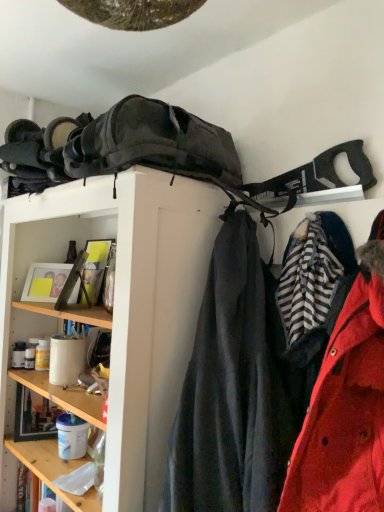
At what (x,y) coordinates should I click in order to perform the action: click on red matte coat at right. Please return your answer as a coordinate pair (x, y). This screenshot has height=512, width=384. Looking at the image, I should click on (346, 404).

The image size is (384, 512). What do you see at coordinates (346, 404) in the screenshot?
I see `red matte coat at right` at bounding box center [346, 404].

Measure the distance between matte black backpack at upper center and camera.

The depth of matte black backpack at upper center is 37.88 inches.

Where is `matte black backpack at upper center`? The image size is (384, 512). matte black backpack at upper center is located at coordinates (119, 307).

Describe the element at coordinates (119, 307) in the screenshot. I see `matte black backpack at upper center` at that location.

Where is `red matte coat at right`? The image size is (384, 512). red matte coat at right is located at coordinates (346, 404).

Which object is positioned more to the left, matte black backpack at upper center or red matte coat at right?

Positioned to the left is matte black backpack at upper center.

Is matte black backpack at upper center positioned behind red matte coat at right?

No, matte black backpack at upper center is closer to the viewer.

Considering the points (16, 272) and (370, 418), which point is behind, point (16, 272) or point (370, 418)?

The point (16, 272) is more distant.

From the image's perspective, which is above, matte black backpack at upper center or red matte coat at right?

red matte coat at right appears higher in the image.

From a real-world perspective, is matte black backpack at upper center on red matte coat at right?

No, from a real-world perspective, matte black backpack at upper center is not on top of red matte coat at right.

Which object is thinner, matte black backpack at upper center or red matte coat at right?

red matte coat at right is thinner.

Who is taller, matte black backpack at upper center or red matte coat at right?

With more height is matte black backpack at upper center.

Which of these two, matte black backpack at upper center or red matte coat at right, is bigger?

Bigger between the two is matte black backpack at upper center.

Is matte black backpack at upper center not within red matte coat at right?

Absolutely, matte black backpack at upper center is external to red matte coat at right.

Is matte black backpack at upper center not near red matte coat at right?

No, matte black backpack at upper center is in close proximity to red matte coat at right.

In the scene shown: Is red matte coat at right at the back of matte black backpack at upper center?

Yes, matte black backpack at upper center is positioned with its back facing red matte coat at right.

Where is `coat lying behind the matte black backpack at upper center`? The height and width of the screenshot is (512, 384). coat lying behind the matte black backpack at upper center is located at coordinates click(346, 404).

Between red matte coat at right and matte black backpack at upper center, which one appears on the left side from the viewer's perspective?

matte black backpack at upper center is more to the left.

Is red matte coat at right in front of or behind matte black backpack at upper center in the image?

Clearly, red matte coat at right is behind matte black backpack at upper center.

Considering the points (379, 326) and (153, 296), which point is behind, point (379, 326) or point (153, 296)?

The point (153, 296) is more distant.

From the image's perspective, is red matte coat at right on top of matte black backpack at upper center?

Yes, from the image's perspective, red matte coat at right is on top of matte black backpack at upper center.

From a real-world perspective, which is physically above, red matte coat at right or matte black backpack at upper center?

From a 3D spatial view, red matte coat at right is above.

Between red matte coat at right and matte black backpack at upper center, which one has larger width?

With larger width is matte black backpack at upper center.

Is red matte coat at right taller or shorter than matte black backpack at upper center?

Considering their sizes, red matte coat at right has less height than matte black backpack at upper center.

In terms of size, does red matte coat at right appear bigger or smaller than matte black backpack at upper center?

Clearly, red matte coat at right is smaller in size than matte black backpack at upper center.

Choose the correct answer: Is red matte coat at right inside matte black backpack at upper center or outside it?

red matte coat at right lies within the bounds of matte black backpack at upper center.

Is there a large distance between red matte coat at right and matte black backpack at upper center?

No, there isn't a large distance between red matte coat at right and matte black backpack at upper center.

Is red matte coat at right oriented away from matte black backpack at upper center?

No, red matte coat at right is not facing away from matte black backpack at upper center.

Image resolution: width=384 pixels, height=512 pixels. Find the location of `shelf below the red matte coat at right (from the image's perspective)`. shelf below the red matte coat at right (from the image's perspective) is located at coordinates (119, 307).

This screenshot has width=384, height=512. What are the coordinates of `coat lying behind the matte black backpack at upper center` in the screenshot? It's located at (346, 404).

I want to click on shelf that appears in front of the red matte coat at right, so click(119, 307).